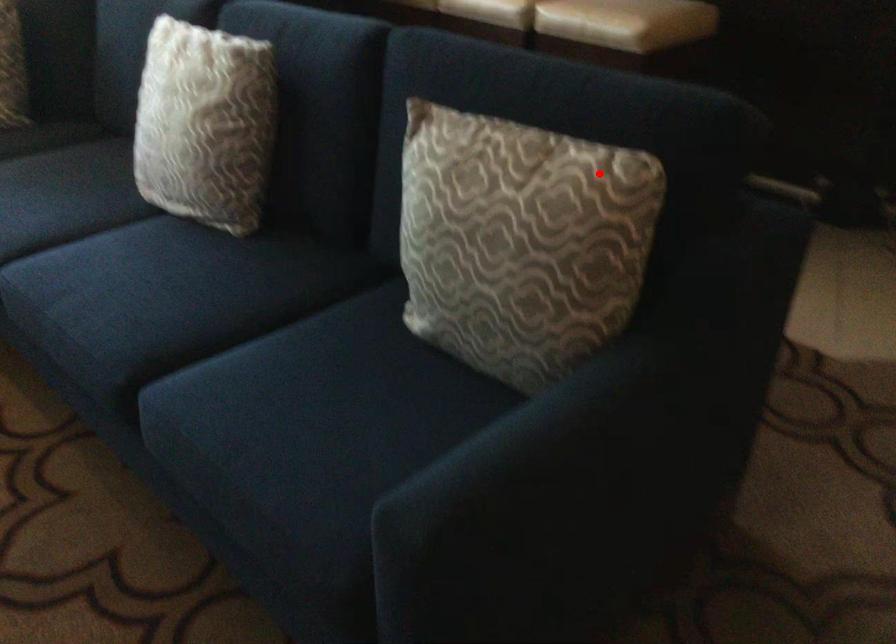
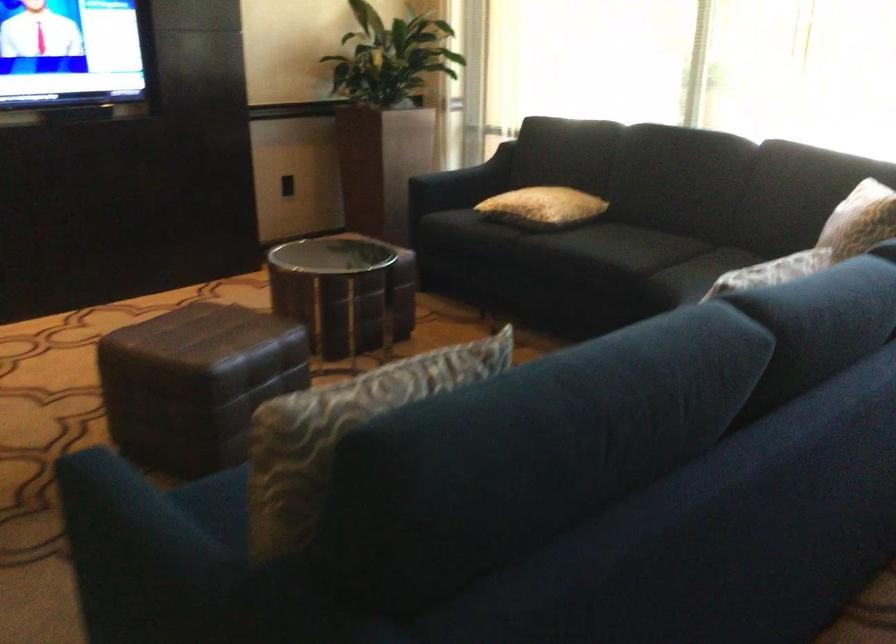
Where in the second image is the point corresponding to the highlighted location from the first image?

(340, 431)